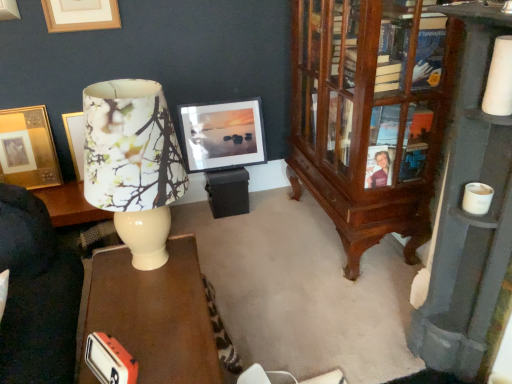
This screenshot has width=512, height=384. What are the coordinates of `empty space that is ontop of white glossy desk at lower left (from a real-world perspective)` in the screenshot? It's located at (150, 311).